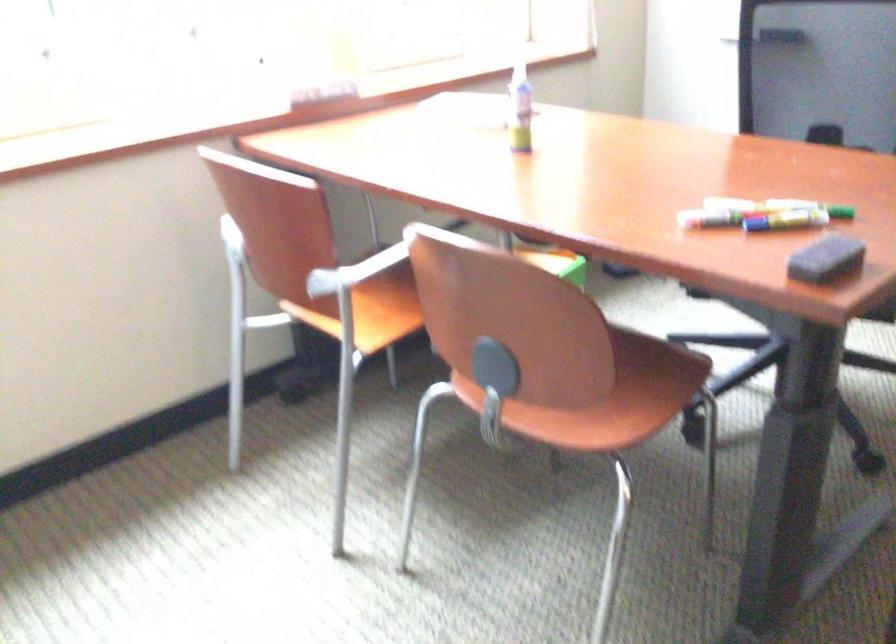
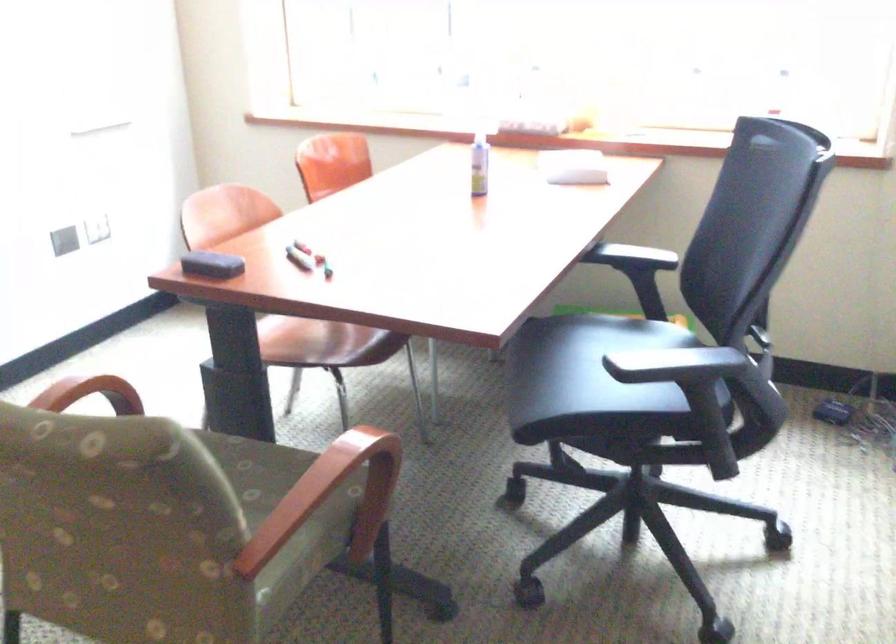
Where in the second image is the point corresponding to point (762, 228) from the first image?

(299, 258)